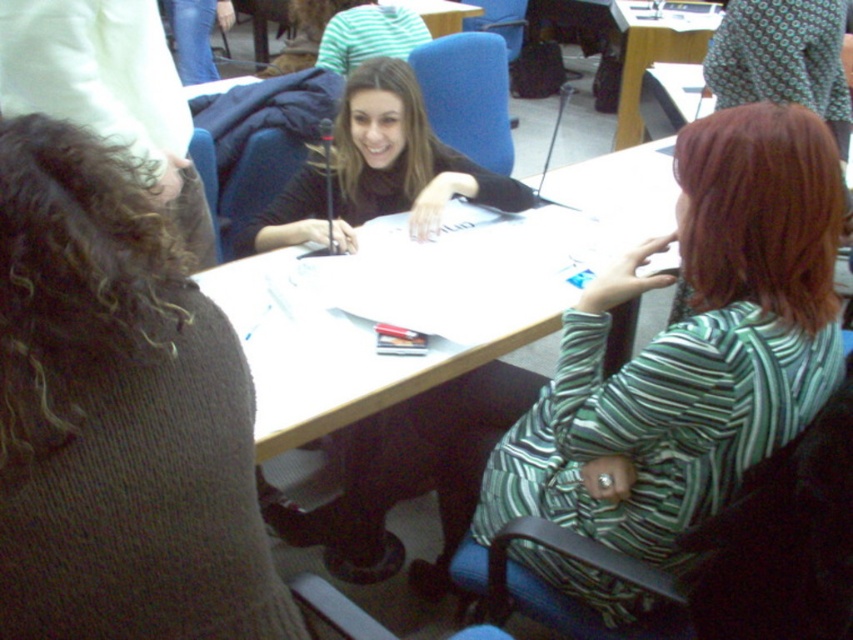
Can you confirm if knitted brown sweater at left is positioned above wooden table at upper center?

Incorrect, knitted brown sweater at left is not positioned above wooden table at upper center.

Can you confirm if knitted brown sweater at left is shorter than wooden table at upper center?

Yes, knitted brown sweater at left is shorter than wooden table at upper center.

Does point (170, 598) lie in front of point (676, 28)?

Yes, point (170, 598) is in front of point (676, 28).

Image resolution: width=853 pixels, height=640 pixels. I want to click on knitted brown sweater at left, so click(x=117, y=417).

From the picture: Who is more distant from viewer, (808, 260) or (346, 240)?

The point (346, 240) is behind.

Which is in front, point (701, 480) or point (347, 152)?

Point (701, 480)

What do you see at coordinates (691, 348) in the screenshot?
I see `green striped shirt at right` at bounding box center [691, 348].

The width and height of the screenshot is (853, 640). I want to click on green striped shirt at right, so click(x=691, y=348).

Is matte black shirt at center taller than matte black sweater at center?

Yes, matte black shirt at center is taller than matte black sweater at center.

Is point (399, 566) in front of point (413, 154)?

Yes, point (399, 566) is closer to viewer.

At what (x,y) coordinates should I click in order to perform the action: click on matte black shirt at center. Please return your answer as a coordinate pair (x, y). Image resolution: width=853 pixels, height=640 pixels. Looking at the image, I should click on (405, 474).